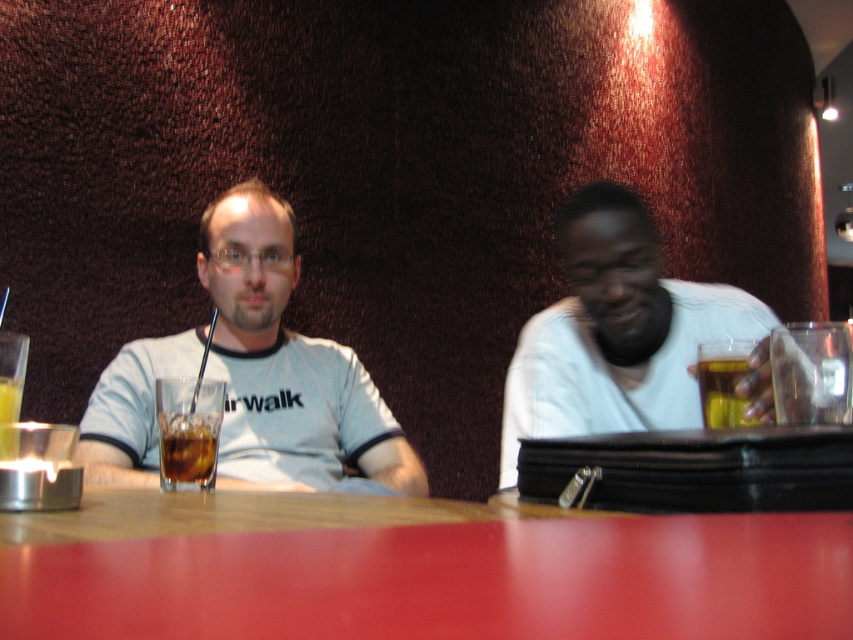
Question: Estimate the real-world distances between objects in this image. Which object is farther from the translucent glass cup at lower left?

Choices:
 (A) translucent glass beer at right
 (B) white matte shirt at right

Answer: (B)

Question: Can you confirm if light gray t-shirt at center is smaller than translucent glass beer at right?

Choices:
 (A) yes
 (B) no

Answer: (B)

Question: Does smooth wooden table at center lie behind brown liquid at table front?

Choices:
 (A) yes
 (B) no

Answer: (B)

Question: Which object is positioned closest to the light gray t-shirt at center?

Choices:
 (A) gray cotton shirt at center
 (B) translucent glass cup at lower left
 (C) brown liquid at table front

Answer: (A)

Question: Is translucent glass beer at right bigger than translucent glass cup at lower left?

Choices:
 (A) no
 (B) yes

Answer: (A)

Question: Which of the following is the farthest from the observer?

Choices:
 (A) (3, 449)
 (B) (733, 369)

Answer: (B)